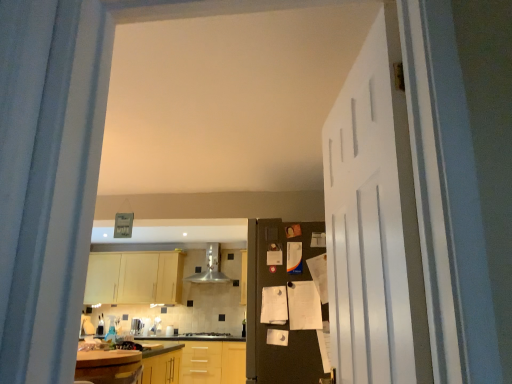
What is the approximate height of wooden at center, which is counted as the 1th countertop, starting from the back?

wooden at center, which is counted as the 1th countertop, starting from the back, is 71.80 centimeters in height.

Where is `black matte refrigerator at center, acting as the first door starting from the back`? This screenshot has height=384, width=512. black matte refrigerator at center, acting as the first door starting from the back is located at coordinates (285, 304).

Identify the location of light wood cabinet at center. The width and height of the screenshot is (512, 384). (134, 278).

The width and height of the screenshot is (512, 384). I want to click on satin silver toaster at center, so click(x=136, y=326).

At what (x,y) coordinates should I click in order to perform the action: click on wooden laminate countertop at lower left, the first countertop viewed from the front. Please return your answer as a coordinate pair (x, y). Looking at the image, I should click on (123, 354).

The image size is (512, 384). I want to click on wooden at center, which appears as the 2th countertop when viewed from the top, so click(x=197, y=361).

Can we say wooden laminate countertop at lower left, the first countertop viewed from the front, lies outside white matte door at right, the 1th door in the front-to-back sequence?

Yes, wooden laminate countertop at lower left, the first countertop viewed from the front, is not within white matte door at right, the 1th door in the front-to-back sequence.

From the image's perspective, starting from the white matte door at right, arranged as the 2th door when viewed from the back, which countertop is the 1st one below? Please provide its 2D coordinates.

[(123, 354)]

From a real-world perspective, does wooden laminate countertop at lower left, the 1th countertop in the top-to-bottom sequence, stand above white matte door at right, the 1th door in the front-to-back sequence?

No, from a real-world perspective, wooden laminate countertop at lower left, the 1th countertop in the top-to-bottom sequence, is not over white matte door at right, the 1th door in the front-to-back sequence

Can you confirm if wooden laminate countertop at lower left, which ranks as the second countertop in back-to-front order, is wider than white matte door at right, the 1th door in the front-to-back sequence?

Yes.

Can you confirm if light wood cabinet at center is smaller than white matte door at right, arranged as the 2th door when viewed from the back?

No.

Is light wood cabinet at center wider than white matte door at right, the 1th door in the front-to-back sequence?

Correct, the width of light wood cabinet at center exceeds that of white matte door at right, the 1th door in the front-to-back sequence.

Considering the relative sizes of light wood cabinet at center and white matte door at right, the 1th door in the front-to-back sequence, in the image provided, is light wood cabinet at center taller than white matte door at right, the 1th door in the front-to-back sequence,?

No, light wood cabinet at center is not taller than white matte door at right, the 1th door in the front-to-back sequence.

Find the location of a particular element. The image size is (512, 384). cabinetry located behind the white matte door at right, the 1th door in the front-to-back sequence is located at coordinates (134, 278).

The height and width of the screenshot is (384, 512). In the image, there is a wooden laminate countertop at lower left, which ranks as the second countertop in back-to-front order. Identify the location of countertop below it (from a real-world perspective). (197, 361).

How many degrees apart are the facing directions of wooden at center, marked as the first countertop in a bottom-to-top arrangement, and wooden laminate countertop at lower left, arranged as the second countertop when ordered from the bottom?

They differ by 89 degrees in their facing directions.

Is wooden at center, marked as the first countertop in a bottom-to-top arrangement, wider than wooden laminate countertop at lower left, arranged as the second countertop when ordered from the bottom?

In fact, wooden at center, marked as the first countertop in a bottom-to-top arrangement, might be narrower than wooden laminate countertop at lower left, arranged as the second countertop when ordered from the bottom.

Is wooden at center, which appears as the 2th countertop when viewed from the top, not near wooden laminate countertop at lower left, which ranks as the second countertop in back-to-front order?

No, wooden at center, which appears as the 2th countertop when viewed from the top, is not far away from wooden laminate countertop at lower left, which ranks as the second countertop in back-to-front order.

Who is more distant, black matte refrigerator at center, acting as the first door starting from the back, or wooden laminate countertop at lower left, the 1th countertop in the top-to-bottom sequence?

wooden laminate countertop at lower left, the 1th countertop in the top-to-bottom sequence, is further away from the camera.

Is black matte refrigerator at center, positioned as the 2th door in front-to-back order, located outside wooden laminate countertop at lower left, which ranks as the second countertop in back-to-front order?

Absolutely, black matte refrigerator at center, positioned as the 2th door in front-to-back order, is external to wooden laminate countertop at lower left, which ranks as the second countertop in back-to-front order.

Does point (305, 371) lie behind point (149, 350)?

No.

Does black matte refrigerator at center, acting as the first door starting from the back, appear on the right side of wooden laminate countertop at lower left, the first countertop viewed from the front?

Yes.

Which is farther from the camera, (132, 322) or (86, 292)?

The point (86, 292) is behind.

Measure the distance between satin silver toaster at center and light wood cabinet at center.

They are 3.30 feet apart.

Identify the location of appliance that is behind the light wood cabinet at center. click(x=136, y=326).

Between satin silver toaster at center and light wood cabinet at center, which one appears on the right side from the viewer's perspective?

satin silver toaster at center is more to the right.

Is point (198, 282) closer or farther from the camera than point (175, 345)?

Point (198, 282) is positioned farther from the camera compared to point (175, 345).

From a real-world perspective, who is located lower, stainless steel exhaust hood at center or wooden laminate countertop at lower left, arranged as the second countertop when ordered from the bottom?

In real-world perspective, wooden laminate countertop at lower left, arranged as the second countertop when ordered from the bottom, is lower.

Between stainless steel exhaust hood at center and wooden laminate countertop at lower left, arranged as the second countertop when ordered from the bottom, which one appears on the left side from the viewer's perspective?

Positioned to the left is wooden laminate countertop at lower left, arranged as the second countertop when ordered from the bottom.

Based on their sizes in the image, would you say stainless steel exhaust hood at center is bigger or smaller than wooden laminate countertop at lower left, which ranks as the second countertop in back-to-front order?

Considering their sizes, stainless steel exhaust hood at center takes up less space than wooden laminate countertop at lower left, which ranks as the second countertop in back-to-front order.

Is wooden at center, positioned as the 2th countertop in front-to-back order, positioned beyond the bounds of satin silver toaster at center?

Yes, wooden at center, positioned as the 2th countertop in front-to-back order, is located beyond the bounds of satin silver toaster at center.

Could you tell me if wooden at center, which appears as the 2th countertop when viewed from the top, is facing satin silver toaster at center?

No, wooden at center, which appears as the 2th countertop when viewed from the top, is not turned towards satin silver toaster at center.

Measure the distance from wooden at center, marked as the first countertop in a bottom-to-top arrangement, to satin silver toaster at center.

wooden at center, marked as the first countertop in a bottom-to-top arrangement, and satin silver toaster at center are 33.66 inches apart from each other.

How different are the orientations of wooden at center, marked as the first countertop in a bottom-to-top arrangement, and satin silver toaster at center in degrees?

4.04 degrees.

From the image's perspective, count 1st countertops downward from the white matte door at right, arranged as the 2th door when viewed from the back, and point to it. Please provide its 2D coordinates.

[(123, 354)]

Image resolution: width=512 pixels, height=384 pixels. In order to click on the 2nd door in front of the light wood cabinet at center, counting from the anchor's position in this screenshot , I will do `click(374, 222)`.

Based on their spatial positions, is wooden at center, positioned as the 2th countertop in front-to-back order, or satin silver toaster at center further from stainless steel exhaust hood at center?

Among the two, wooden at center, positioned as the 2th countertop in front-to-back order, is located further to stainless steel exhaust hood at center.

When comparing their distances from stainless steel exhaust hood at center, does satin silver toaster at center or black matte refrigerator at center, positioned as the 2th door in front-to-back order, seem closer?

satin silver toaster at center.

From the image, which object appears to be farther from wooden laminate countertop at lower left, arranged as the second countertop when ordered from the bottom, light wood cabinet at center or black matte refrigerator at center, positioned as the 2th door in front-to-back order?

Among the two, light wood cabinet at center is located further to wooden laminate countertop at lower left, arranged as the second countertop when ordered from the bottom.

Considering their positions, is white matte door at right, the 1th door in the front-to-back sequence, positioned further to black matte refrigerator at center, positioned as the 2th door in front-to-back order, than light wood cabinet at center?

The object further to black matte refrigerator at center, positioned as the 2th door in front-to-back order, is light wood cabinet at center.

From the picture: Based on their spatial positions, is wooden at center, positioned as the 2th countertop in front-to-back order, or light wood cabinet at center further from stainless steel exhaust hood at center?

Among the two, wooden at center, positioned as the 2th countertop in front-to-back order, is located further to stainless steel exhaust hood at center.

Considering their positions, is black matte refrigerator at center, positioned as the 2th door in front-to-back order, positioned further to satin silver toaster at center than stainless steel exhaust hood at center?

Among the two, black matte refrigerator at center, positioned as the 2th door in front-to-back order, is located further to satin silver toaster at center.

From the image, which object appears to be nearer to wooden laminate countertop at lower left, the 1th countertop in the top-to-bottom sequence, black matte refrigerator at center, acting as the first door starting from the back, or satin silver toaster at center?

satin silver toaster at center is closer to wooden laminate countertop at lower left, the 1th countertop in the top-to-bottom sequence.

Which object lies further to the anchor point stainless steel exhaust hood at center, black matte refrigerator at center, acting as the first door starting from the back, or satin silver toaster at center?

The object further to stainless steel exhaust hood at center is black matte refrigerator at center, acting as the first door starting from the back.

Where is `appliance between light wood cabinet at center and wooden at center, positioned as the 2th countertop in front-to-back order, in the vertical direction`? appliance between light wood cabinet at center and wooden at center, positioned as the 2th countertop in front-to-back order, in the vertical direction is located at coordinates (136, 326).

Image resolution: width=512 pixels, height=384 pixels. I want to click on door between white matte door at right, the 1th door in the front-to-back sequence, and light wood cabinet at center from front to back, so click(285, 304).

The width and height of the screenshot is (512, 384). In order to click on countertop between wooden laminate countertop at lower left, which ranks as the second countertop in back-to-front order, and stainless steel exhaust hood at center in the front-back direction in this screenshot , I will do `click(197, 361)`.

Locate an element on the screen. The width and height of the screenshot is (512, 384). cabinetry between stainless steel exhaust hood at center and wooden at center, positioned as the 2th countertop in front-to-back order, in the up-down direction is located at coordinates (134, 278).